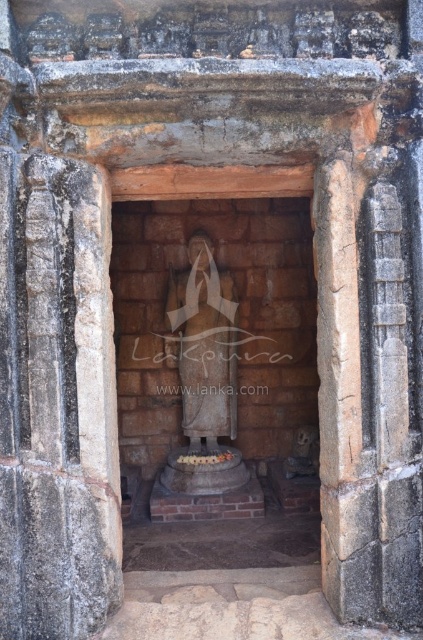
You are standing outside the stone archway and want to place a new decorative item exactly where the brown stone statue at center is currently located. According to the coordinates provided, where should you place the new item?

The brown stone statue at center is located at coordinates point (214, 364), so you should place the new decorative item at that exact position.

You are standing at the entrance of the archway and want to reach the statue in the center of the chamber. There are two points marked on the path, point (286,259) and point (203,257). Which point should you step on first to reach the statue?

You should step on point (203,257) first because it is in front of point (286,259), which is behind it.